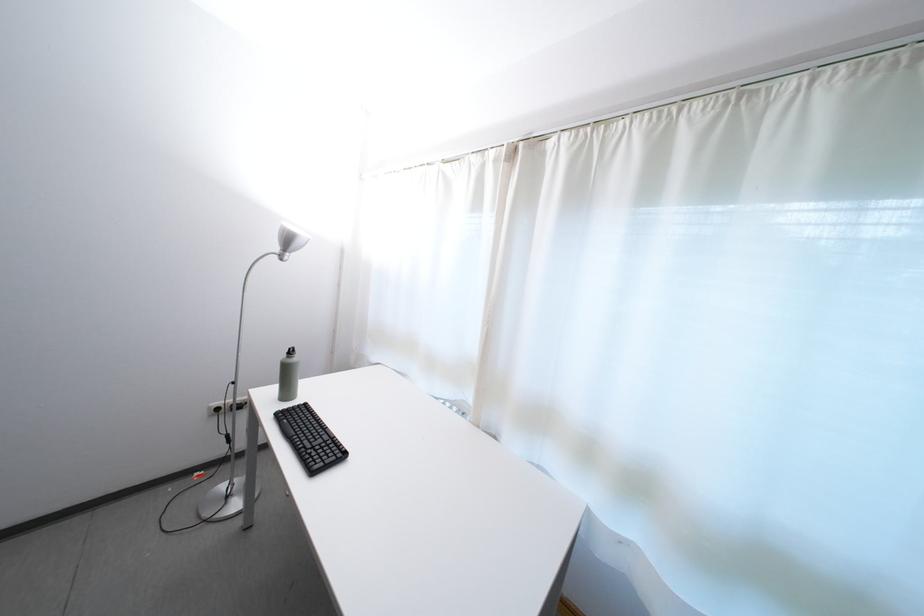
Find where to plugg the white wall socket. Please return your answer as a coordinate pair (x, y).

(219, 408)